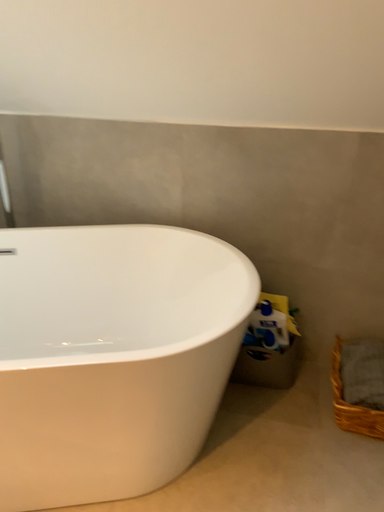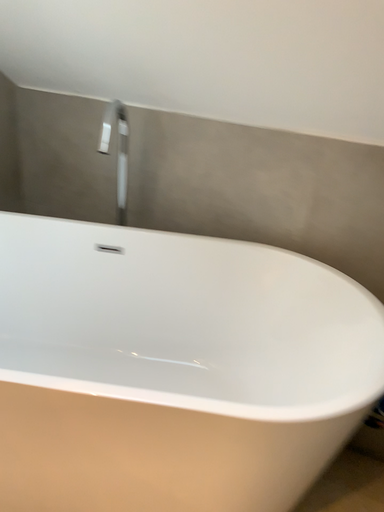
Question: How did the camera likely rotate when shooting the video?

Choices:
 (A) rotated left
 (B) rotated right

Answer: (A)